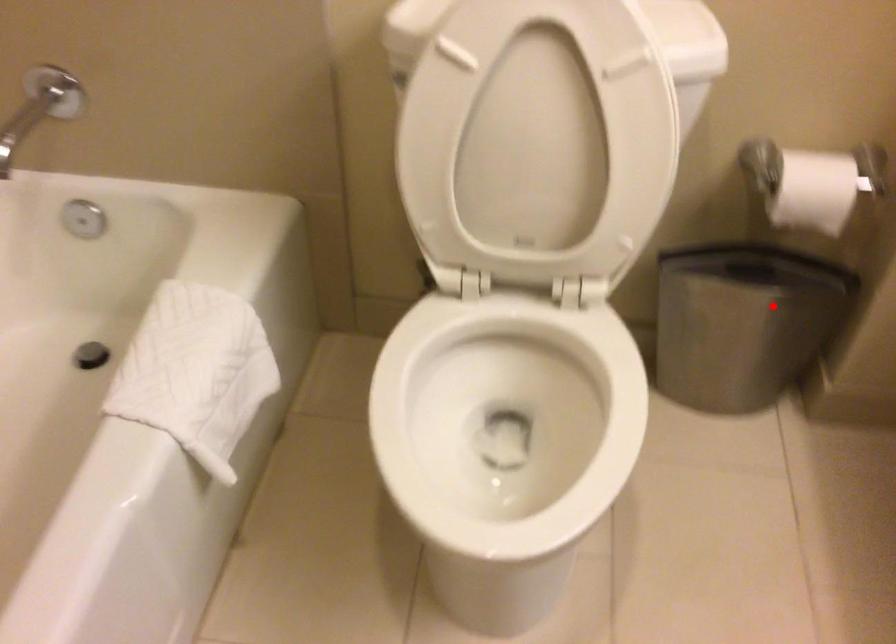
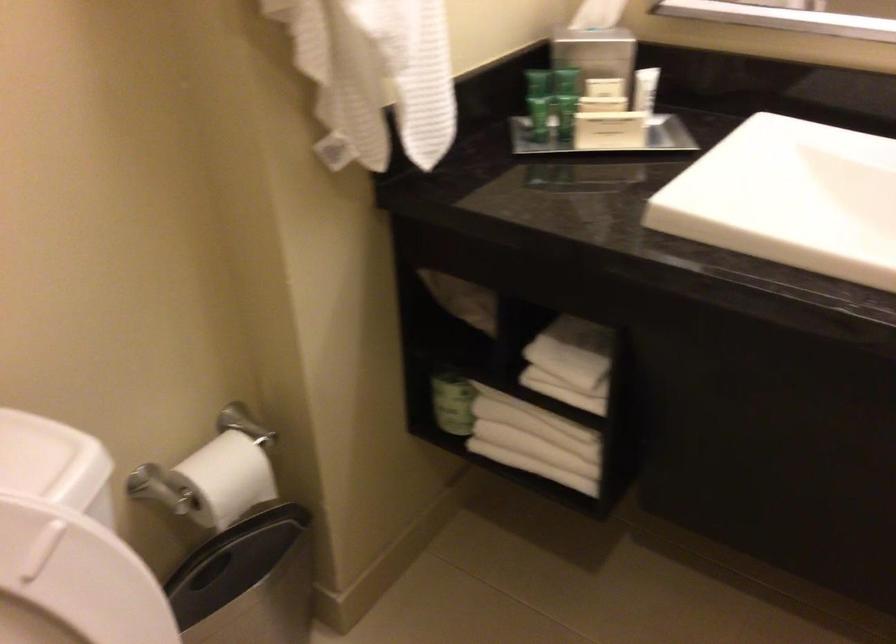
In the second image, find the point that corresponds to the highlighted location in the first image.

(247, 582)